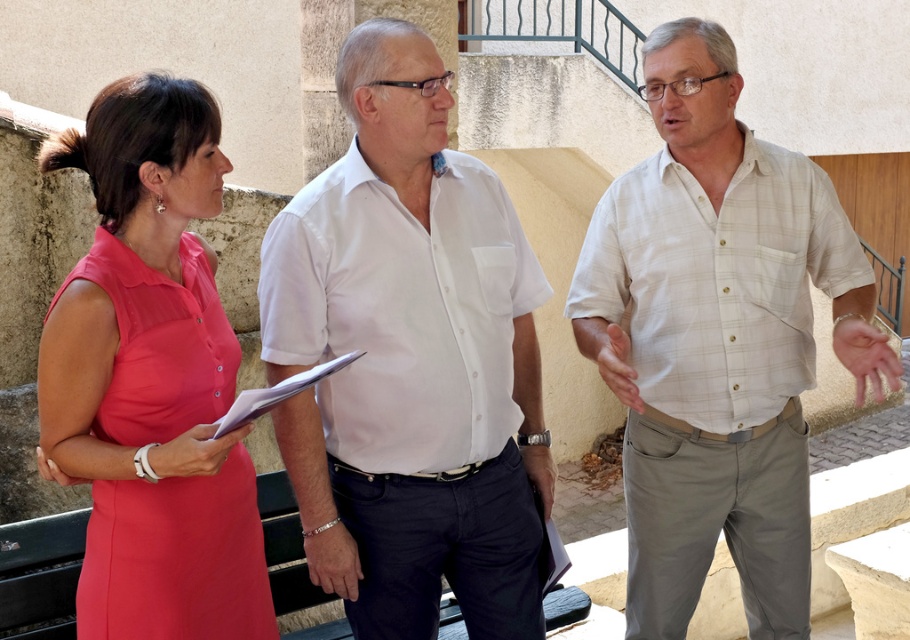
Looking at this image, is satin pink dress at left positioned at the back of white paper clipboard at center?

That is True.

Is satin pink dress at left bigger than white paper clipboard at center?

Yes, satin pink dress at left is bigger than white paper clipboard at center.

Is point (91, 595) closer to viewer compared to point (275, 396)?

No, (91, 595) is further to viewer.

Where is `satin pink dress at left`? Image resolution: width=910 pixels, height=640 pixels. satin pink dress at left is located at coordinates (177, 557).

Does light beige plaid shirt at center have a smaller size compared to satin pink dress at left?

No.

The width and height of the screenshot is (910, 640). I want to click on light beige plaid shirt at center, so click(718, 340).

This screenshot has width=910, height=640. Identify the location of light beige plaid shirt at center. (718, 340).

This screenshot has height=640, width=910. Describe the element at coordinates (410, 362) in the screenshot. I see `white cotton shirt at center` at that location.

Based on the photo, who is more distant from viewer, (337, 435) or (249, 417)?

Positioned behind is point (337, 435).

Locate an element on the screen. This screenshot has height=640, width=910. white cotton shirt at center is located at coordinates (410, 362).